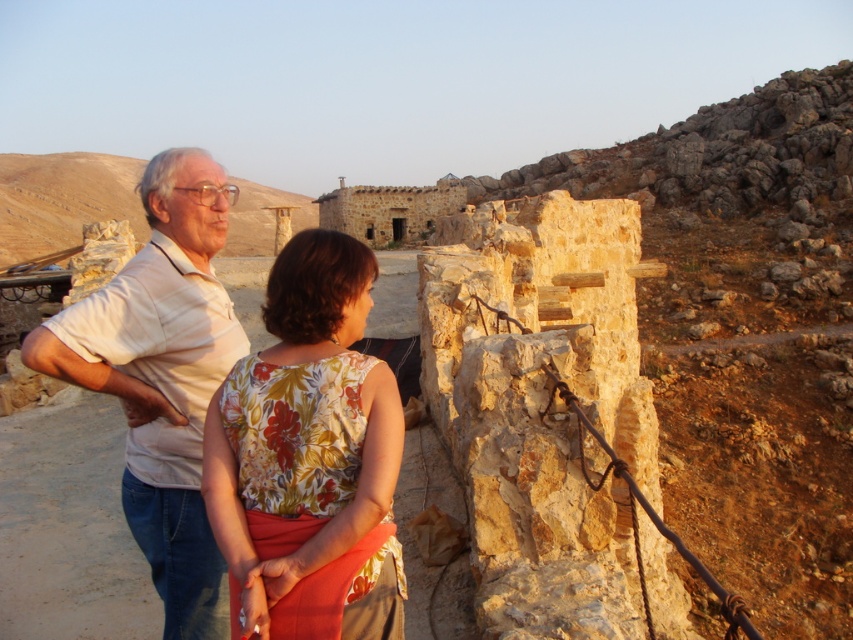
Which is behind, point (376, 628) or point (170, 554)?

The point (170, 554) is more distant.

Between point (354, 444) and point (171, 358), which one is positioned in front?

Point (354, 444) is more forward.

This screenshot has height=640, width=853. I want to click on floral fabric blouse at center, so click(x=308, y=456).